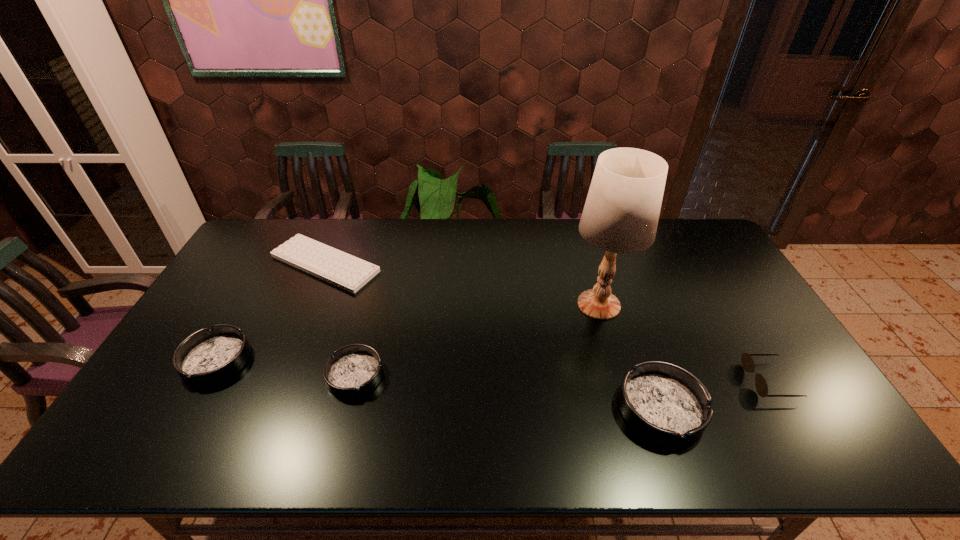
Find the location of a particular element. This screenshot has width=960, height=540. location for an additional ashtray to make spacing equal is located at coordinates (503, 392).